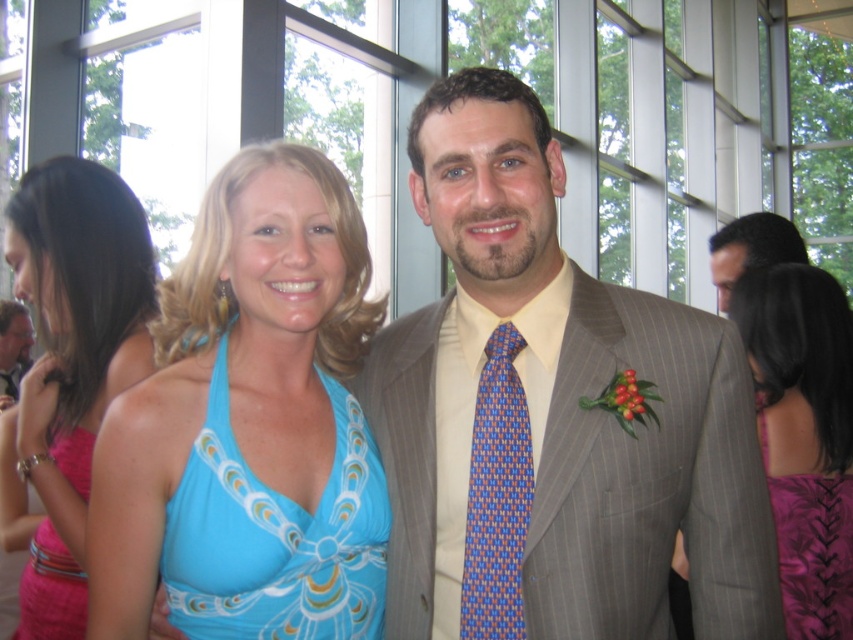
You are a photographer at the event and want to adjust the camera focus to the gray pinstripe suit at center. What are the coordinates you should set?

The coordinates for the gray pinstripe suit at center are at point [552,416].

You are standing at the camera position and want to place a 1.5 meter long banner between you and the point at point (x=169, y=620). Will the banner fit without overlapping the point?

The distance between you and the point at point (x=169, y=620) is 1.68 meters. Since the banner is 1.5 meters long, it will fit without overlapping the point, leaving 0.18 meters of space.

In the scene shown: You are a photographer at a formal event and need to adjust the lighting to ensure both the purple floral dress at lower right and the pink satin dress at lower left are well lit. Based on their positions, which dress is closer to the right side of the frame?

The purple floral dress at lower right is positioned on the right side of the pink satin dress at lower left, so it is closer to the right side of the frame.